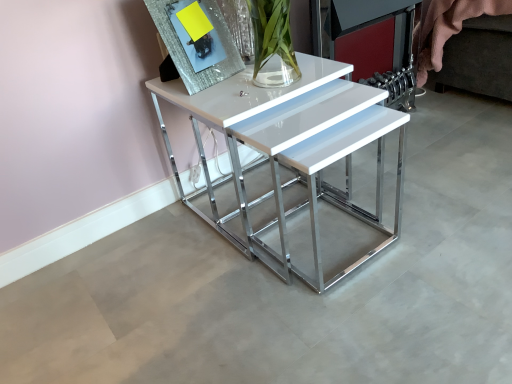
At what (x,y) coordinates should I click in order to perform the action: click on sparkly silver picture frame at upper left. Please return your answer as a coordinate pair (x, y). This screenshot has height=384, width=512. Looking at the image, I should click on (196, 41).

This screenshot has width=512, height=384. Describe the element at coordinates (196, 41) in the screenshot. I see `sparkly silver picture frame at upper left` at that location.

The image size is (512, 384). What do you see at coordinates (292, 149) in the screenshot? I see `white glossy table at center` at bounding box center [292, 149].

Locate an element on the screen. white glossy table at center is located at coordinates (292, 149).

Find the location of a particular element. Image resolution: width=512 pixels, height=384 pixels. sparkly silver picture frame at upper left is located at coordinates (196, 41).

Between sparkly silver picture frame at upper left and white glossy table at center, which one appears on the right side from the viewer's perspective?

From the viewer's perspective, white glossy table at center appears more on the right side.

Based on the photo, considering the positions of objects sparkly silver picture frame at upper left and white glossy table at center in the image provided, who is in front, sparkly silver picture frame at upper left or white glossy table at center?

Positioned in front is white glossy table at center.

Does point (200, 67) lie behind point (182, 192)?

No, it is in front of (182, 192).

From the image's perspective, who appears lower, sparkly silver picture frame at upper left or white glossy table at center?

white glossy table at center.

From a real-world perspective, which object stands above the other?

From a 3D spatial view, sparkly silver picture frame at upper left is above.

Considering the sizes of objects sparkly silver picture frame at upper left and white glossy table at center in the image provided, who is wider, sparkly silver picture frame at upper left or white glossy table at center?

With larger width is white glossy table at center.

Considering the sizes of objects sparkly silver picture frame at upper left and white glossy table at center in the image provided, who is shorter, sparkly silver picture frame at upper left or white glossy table at center?

With less height is sparkly silver picture frame at upper left.

Considering the sizes of sparkly silver picture frame at upper left and white glossy table at center in the image, is sparkly silver picture frame at upper left bigger or smaller than white glossy table at center?

Clearly, sparkly silver picture frame at upper left is smaller in size than white glossy table at center.

Can we say sparkly silver picture frame at upper left lies outside white glossy table at center?

Absolutely, sparkly silver picture frame at upper left is external to white glossy table at center.

Is sparkly silver picture frame at upper left next to white glossy table at center?

sparkly silver picture frame at upper left is not next to white glossy table at center, and they're not touching.

Is sparkly silver picture frame at upper left looking in the opposite direction of white glossy table at center?

No, sparkly silver picture frame at upper left's orientation is not away from white glossy table at center.

Can you tell me how much sparkly silver picture frame at upper left and white glossy table at center differ in facing direction?

They differ by 8.83 degrees in their facing directions.

Measure the distance between sparkly silver picture frame at upper left and white glossy table at center.

The distance of sparkly silver picture frame at upper left from white glossy table at center is 11.09 inches.

Find the location of a particular element. The width and height of the screenshot is (512, 384). table that appears below the sparkly silver picture frame at upper left (from the image's perspective) is located at coordinates (292, 149).

Considering the relative positions of white glossy table at center and sparkly silver picture frame at upper left in the image provided, is white glossy table at center to the right of sparkly silver picture frame at upper left from the viewer's perspective?

Yes, white glossy table at center is to the right of sparkly silver picture frame at upper left.

Considering the relative positions of white glossy table at center and sparkly silver picture frame at upper left in the image provided, is white glossy table at center in front of sparkly silver picture frame at upper left?

Yes, white glossy table at center is closer to the camera.

Is point (247, 125) closer or farther from the camera than point (229, 64)?

Point (247, 125) appears to be closer to the viewer than point (229, 64).

From the image's perspective, between white glossy table at center and sparkly silver picture frame at upper left, which one is located above?

From the image's view, sparkly silver picture frame at upper left is above.

In the scene shown: From a real-world perspective, between white glossy table at center and sparkly silver picture frame at upper left, who is vertically lower?

white glossy table at center.

Between white glossy table at center and sparkly silver picture frame at upper left, which one has smaller width?

With smaller width is sparkly silver picture frame at upper left.

Between white glossy table at center and sparkly silver picture frame at upper left, which one has more height?

Standing taller between the two is white glossy table at center.

Which of these two, white glossy table at center or sparkly silver picture frame at upper left, is bigger?

With larger size is white glossy table at center.

Is white glossy table at center positioned beyond the bounds of sparkly silver picture frame at upper left?

Yes.

Is the surface of white glossy table at center in direct contact with sparkly silver picture frame at upper left?

No, white glossy table at center is not with sparkly silver picture frame at upper left.

Does white glossy table at center turn towards sparkly silver picture frame at upper left?

No, white glossy table at center is not oriented towards sparkly silver picture frame at upper left.

Can you tell me how much white glossy table at center and sparkly silver picture frame at upper left differ in facing direction?

There is a 8.83-degree angle between the facing directions of white glossy table at center and sparkly silver picture frame at upper left.

Where is `table below the sparkly silver picture frame at upper left (from the image's perspective)`? Image resolution: width=512 pixels, height=384 pixels. table below the sparkly silver picture frame at upper left (from the image's perspective) is located at coordinates (292, 149).

You are a GUI agent. You are given a task and a screenshot of the screen. Output one action in this format:
    pyautogui.click(x=<x>, y=<y>)
    Task: Click on the table that appears on the right of sparkly silver picture frame at upper left
    The image size is (512, 384).
    Given the screenshot: What is the action you would take?
    pyautogui.click(x=292, y=149)

Where is `picture frame behind the white glossy table at center`? This screenshot has width=512, height=384. picture frame behind the white glossy table at center is located at coordinates (196, 41).